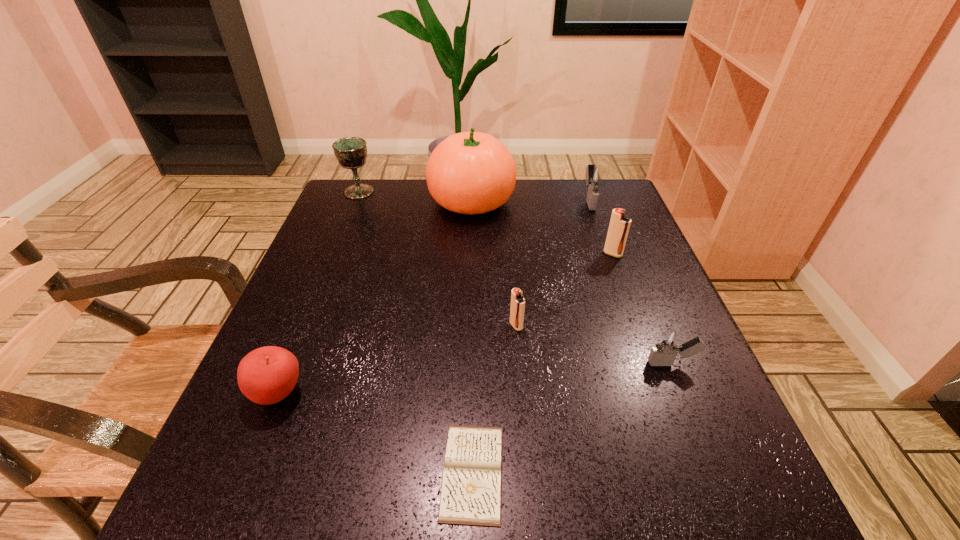
This screenshot has width=960, height=540. In order to click on free space in the image that satisfies the following two spatial constraints: 1. on the back side of the shortest object; 2. on the left side of the left red igniter in this screenshot , I will do `click(474, 326)`.